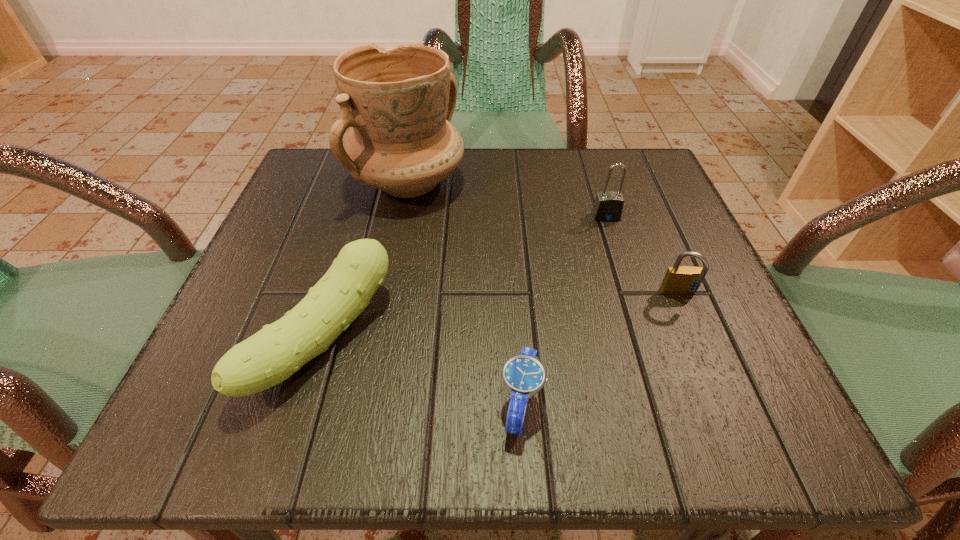
This screenshot has width=960, height=540. Identify the location of object present at the near left corner. (270, 356).

Where is `object that is at the far right corner`? This screenshot has width=960, height=540. object that is at the far right corner is located at coordinates (608, 206).

This screenshot has width=960, height=540. In the image, there is a desktop. In order to click on vacant space at the far edge in this screenshot , I will do `click(484, 173)`.

At what (x,y) coordinates should I click in order to perform the action: click on vacant area at the near edge. Please return your answer as a coordinate pair (x, y). Image resolution: width=960 pixels, height=540 pixels. Looking at the image, I should click on (368, 396).

Locate an element on the screen. free space at the right edge of the desktop is located at coordinates (631, 292).

In the image, there is a desktop. Identify the location of vacant space at the far left corner. The height and width of the screenshot is (540, 960). (339, 180).

Locate an element on the screen. The width and height of the screenshot is (960, 540). vacant space at the far right corner of the desktop is located at coordinates (673, 210).

In the image, there is a desktop. Where is `free region at the near right corner`? The width and height of the screenshot is (960, 540). free region at the near right corner is located at coordinates (653, 402).

Find the location of a particular element. The width and height of the screenshot is (960, 540). free spot between the cucumber and the rightmost object is located at coordinates (501, 317).

Identify the location of empty space between the pottery and the farther padlock. This screenshot has height=540, width=960. (507, 199).